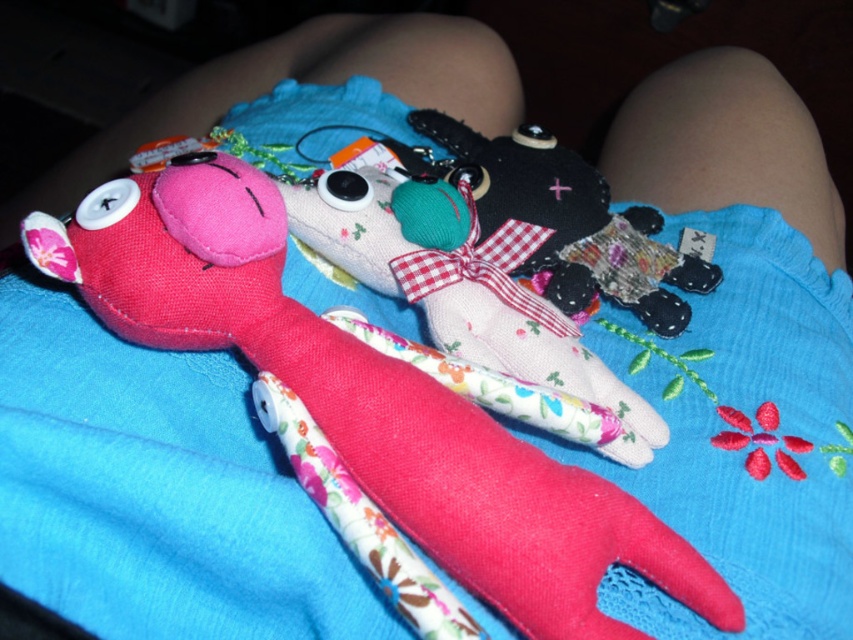
Find the location of a particular element. floral fabric stuffed animal at center is located at coordinates (462, 284).

Is floral fabric stuffed animal at center below flannel fabric stuffed animal at center?

Yes, floral fabric stuffed animal at center is below flannel fabric stuffed animal at center.

What are the coordinates of `floral fabric stuffed animal at center` in the screenshot? It's located at (462, 284).